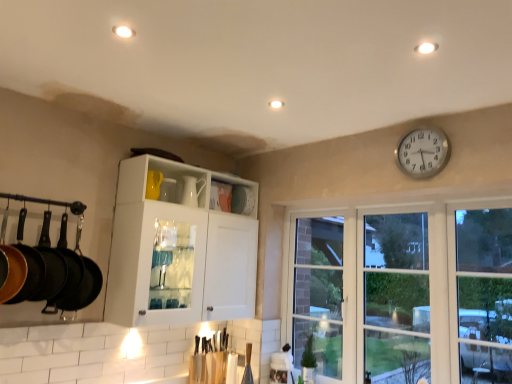
At what (x,y) coordinates should I click in order to perform the action: click on white metallic clock at upper right. Please return your answer as a coordinate pair (x, y). The height and width of the screenshot is (384, 512). Looking at the image, I should click on (423, 153).

The width and height of the screenshot is (512, 384). Identify the location of matte black frying pan at left, which appears as the 3th frying pan when viewed from the back. (28, 264).

At what (x,y) coordinates should I click in order to perform the action: click on transparent glass window at right. Please return your answer as a coordinate pair (x, y). This screenshot has width=512, height=384. Looking at the image, I should click on (402, 291).

Who is smaller, gold matte frying pan at left, which is the 4th frying pan from back to front, or transparent glass window at right?

With smaller size is gold matte frying pan at left, which is the 4th frying pan from back to front.

Are gold matte frying pan at left, which is the 4th frying pan from back to front, and transparent glass window at right far apart?

Yes, gold matte frying pan at left, which is the 4th frying pan from back to front, and transparent glass window at right are quite far apart.

From the picture: Is gold matte frying pan at left, which is the 1th frying pan from front to back, looking in the opposite direction of transparent glass window at right?

gold matte frying pan at left, which is the 1th frying pan from front to back, is not turned away from transparent glass window at right.

Is gold matte frying pan at left, which is the 4th frying pan from back to front, situated inside transparent glass window at right or outside?

gold matte frying pan at left, which is the 4th frying pan from back to front, lies outside transparent glass window at right.

Is white metallic clock at upper right oriented away from transparent glass window at right?

No, white metallic clock at upper right is not facing away from transparent glass window at right.

The width and height of the screenshot is (512, 384). In the image, there is a transparent glass window at right. In order to click on clock above it (from the image's perspective) in this screenshot , I will do `click(423, 153)`.

Is white metallic clock at upper right wider than transparent glass window at right?

No, white metallic clock at upper right is not wider than transparent glass window at right.

Is white metallic clock at upper right further to the viewer compared to transparent glass window at right?

Yes, the depth of white metallic clock at upper right is greater than that of transparent glass window at right.

How many degrees apart are the facing directions of transparent glass window at right and white glossy cabinet at center?

The angular difference between transparent glass window at right and white glossy cabinet at center is 90.6 degrees.

From the image's perspective, which is above, transparent glass window at right or white glossy cabinet at center?

From the image's view, white glossy cabinet at center is above.

Who is shorter, transparent glass window at right or white glossy cabinet at center?

Standing shorter between the two is white glossy cabinet at center.

Locate an element on the screen. The height and width of the screenshot is (384, 512). cabinetry above the transparent glass window at right (from a real-world perspective) is located at coordinates (180, 247).

Is matte black frying pan at left, positioned as the 2th frying pan in front-to-back order, taller or shorter than white metallic clock at upper right?

matte black frying pan at left, positioned as the 2th frying pan in front-to-back order, is taller than white metallic clock at upper right.

Can you see matte black frying pan at left, which appears as the 3th frying pan when viewed from the back, touching white metallic clock at upper right?

No, matte black frying pan at left, which appears as the 3th frying pan when viewed from the back, is not in contact with white metallic clock at upper right.

Is point (20, 234) positioned after point (408, 152)?

No, it is in front of (408, 152).

Between point (12, 273) and point (37, 257), which one is positioned in front?

Point (12, 273)

Considering the sizes of objects gold matte frying pan at left, which is the 1th frying pan from front to back, and matte black frying pan at left, positioned as the 2th frying pan in front-to-back order, in the image provided, who is shorter, gold matte frying pan at left, which is the 1th frying pan from front to back, or matte black frying pan at left, positioned as the 2th frying pan in front-to-back order,?

With less height is matte black frying pan at left, positioned as the 2th frying pan in front-to-back order.

Is gold matte frying pan at left, which is the 1th frying pan from front to back, far away from matte black frying pan at left, positioned as the 2th frying pan in front-to-back order?

gold matte frying pan at left, which is the 1th frying pan from front to back, is near matte black frying pan at left, positioned as the 2th frying pan in front-to-back order, not far away.

From a real-world perspective, is gold matte frying pan at left, which is the 1th frying pan from front to back, beneath matte black frying pan at left, positioned as the 2th frying pan in front-to-back order?

No, from a real-world perspective, gold matte frying pan at left, which is the 1th frying pan from front to back, is not below matte black frying pan at left, positioned as the 2th frying pan in front-to-back order.

How many degrees apart are the facing directions of matte black frying pan at left, which appears as the 3th frying pan when viewed from the back, and matte black frying pan at left, the 3th frying pan viewed from the front?

There is a 3.41-degree angle between the facing directions of matte black frying pan at left, which appears as the 3th frying pan when viewed from the back, and matte black frying pan at left, the 3th frying pan viewed from the front.

Between point (20, 238) and point (59, 267), which one is positioned behind?

The point (59, 267) is farther from the camera.

Considering the sizes of objects matte black frying pan at left, which appears as the 3th frying pan when viewed from the back, and matte black frying pan at left, which ranks as the 2th frying pan in back-to-front order, in the image provided, who is wider, matte black frying pan at left, which appears as the 3th frying pan when viewed from the back, or matte black frying pan at left, which ranks as the 2th frying pan in back-to-front order,?

With larger width is matte black frying pan at left, which appears as the 3th frying pan when viewed from the back.

Considering the relative positions of matte black frying pan at left, which appears as the 3th frying pan when viewed from the back, and black cast iron frying pan at left, positioned as the first frying pan in back-to-front order, in the image provided, is matte black frying pan at left, which appears as the 3th frying pan when viewed from the back, to the left of black cast iron frying pan at left, positioned as the first frying pan in back-to-front order, from the viewer's perspective?

Correct, you'll find matte black frying pan at left, which appears as the 3th frying pan when viewed from the back, to the left of black cast iron frying pan at left, positioned as the first frying pan in back-to-front order.

Relative to black cast iron frying pan at left, positioned as the first frying pan in back-to-front order, is matte black frying pan at left, which appears as the 3th frying pan when viewed from the back, in front or behind?

Clearly, matte black frying pan at left, which appears as the 3th frying pan when viewed from the back, is in front of black cast iron frying pan at left, positioned as the first frying pan in back-to-front order.

Where is `frying pan that is the 2nd one when counting forward from the transparent glass window at right`? This screenshot has width=512, height=384. frying pan that is the 2nd one when counting forward from the transparent glass window at right is located at coordinates (12, 265).

You are a GUI agent. You are given a task and a screenshot of the screen. Output one action in this format:
    pyautogui.click(x=<x>, y=<y>)
    Task: Click on the clock on the right of transparent glass window at right
    The width and height of the screenshot is (512, 384).
    Given the screenshot: What is the action you would take?
    pyautogui.click(x=423, y=153)

From the image, which object appears to be farther from white glossy cabinet at center, matte black frying pan at left, positioned as the 2th frying pan in front-to-back order, or transparent glass window at right?

Among the two, transparent glass window at right is located further to white glossy cabinet at center.

Looking at the image, which one is located closer to white metallic clock at upper right, black cast iron frying pan at left, positioned as the first frying pan in back-to-front order, or transparent glass window at right?

transparent glass window at right.

From the image, which object appears to be nearer to transparent glass window at right, matte black frying pan at left, which appears as the 3th frying pan when viewed from the back, or white metallic clock at upper right?

white metallic clock at upper right is positioned closer to the anchor transparent glass window at right.

Looking at the image, which one is located closer to white glossy cabinet at center, white metallic clock at upper right or matte black frying pan at left, which ranks as the 2th frying pan in back-to-front order?

matte black frying pan at left, which ranks as the 2th frying pan in back-to-front order, is closer to white glossy cabinet at center.

Which object lies nearer to the anchor point transparent glass window at right, gold matte frying pan at left, which is the 4th frying pan from back to front, or black cast iron frying pan at left, positioned as the 4th frying pan in front-to-back order?

Based on the image, black cast iron frying pan at left, positioned as the 4th frying pan in front-to-back order, appears to be nearer to transparent glass window at right.

Which object lies nearer to the anchor point transparent glass window at right, white metallic clock at upper right or gold matte frying pan at left, which is the 4th frying pan from back to front?

white metallic clock at upper right lies closer to transparent glass window at right than the other object.

Looking at the image, which one is located further to matte black frying pan at left, positioned as the 2th frying pan in front-to-back order, white metallic clock at upper right or white glossy cabinet at center?

Among the two, white metallic clock at upper right is located further to matte black frying pan at left, positioned as the 2th frying pan in front-to-back order.

From the picture: Looking at the image, which one is located further to gold matte frying pan at left, which is the 4th frying pan from back to front, matte black frying pan at left, the 3th frying pan viewed from the front, or transparent glass window at right?

transparent glass window at right is positioned further to the anchor gold matte frying pan at left, which is the 4th frying pan from back to front.

You are a GUI agent. You are given a task and a screenshot of the screen. Output one action in this format:
    pyautogui.click(x=<x>, y=<y>)
    Task: Click on the window between black cast iron frying pan at left, positioned as the 4th frying pan in front-to-back order, and white metallic clock at upper right from left to right
    The width and height of the screenshot is (512, 384).
    Given the screenshot: What is the action you would take?
    pyautogui.click(x=402, y=291)

Locate an element on the screen. cabinetry situated between matte black frying pan at left, which ranks as the 2th frying pan in back-to-front order, and transparent glass window at right from left to right is located at coordinates (180, 247).

The image size is (512, 384). Find the location of `cabinetry between gold matte frying pan at left, which is the 1th frying pan from front to back, and transparent glass window at right from left to right`. cabinetry between gold matte frying pan at left, which is the 1th frying pan from front to back, and transparent glass window at right from left to right is located at coordinates (180, 247).

The height and width of the screenshot is (384, 512). What are the coordinates of `frying pan located between gold matte frying pan at left, which is the 1th frying pan from front to back, and matte black frying pan at left, the 3th frying pan viewed from the front, in the depth direction` in the screenshot? It's located at click(x=28, y=264).